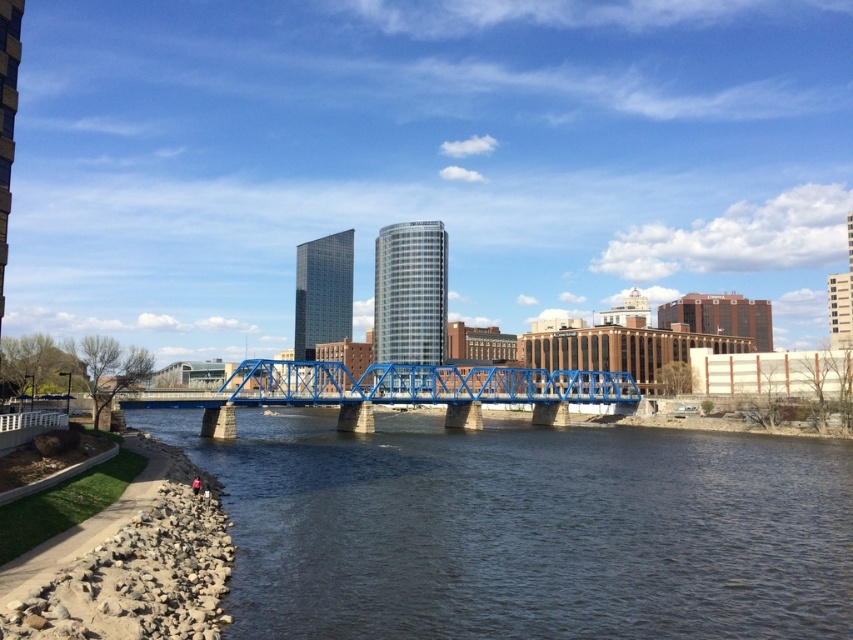
Who is more forward, (x=511, y=497) or (x=341, y=413)?

Point (x=511, y=497) is in front.

Does dark blue water at lower center have a lesser height compared to blue metallic bridge at center?

Yes, dark blue water at lower center is shorter than blue metallic bridge at center.

Does point (735, 509) come farther from viewer compared to point (282, 369)?

That is False.

Identify the location of dark blue water at lower center. (525, 529).